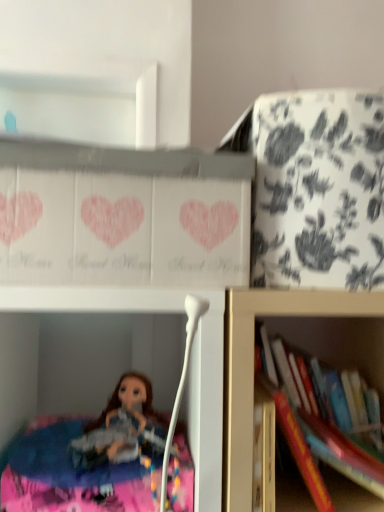
Question: Can you confirm if hardcover book at right, placed as the first book when sorted from back to front, is smaller than hardcover book at lower right, acting as the 1th book starting from the front?

Choices:
 (A) no
 (B) yes

Answer: (A)

Question: From the image's perspective, is hardcover book at right, placed as the first book when sorted from back to front, on top of hardcover book at lower right, positioned as the 2th book in back-to-front order?

Choices:
 (A) yes
 (B) no

Answer: (A)

Question: From the image's perspective, is hardcover book at right, placed as the first book when sorted from back to front, located beneath hardcover book at lower right, positioned as the 2th book in back-to-front order?

Choices:
 (A) yes
 (B) no

Answer: (B)

Question: From a real-world perspective, is hardcover book at right, arranged as the second book when viewed from the front, positioned under hardcover book at lower right, acting as the 1th book starting from the front, based on gravity?

Choices:
 (A) yes
 (B) no

Answer: (B)

Question: Considering the relative positions of hardcover book at right, placed as the first book when sorted from back to front, and hardcover book at lower right, acting as the 1th book starting from the front, in the image provided, is hardcover book at right, placed as the first book when sorted from back to front, to the left of hardcover book at lower right, acting as the 1th book starting from the front, from the viewer's perspective?

Choices:
 (A) yes
 (B) no

Answer: (A)

Question: Would you say hardcover book at right, arranged as the second book when viewed from the front, contains hardcover book at lower right, positioned as the 2th book in back-to-front order?

Choices:
 (A) yes
 (B) no

Answer: (B)

Question: From a real-world perspective, is hardcover book at lower right, positioned as the 2th book in back-to-front order, located beneath hardcover book at right, placed as the first book when sorted from back to front?

Choices:
 (A) no
 (B) yes

Answer: (B)

Question: Can you confirm if hardcover book at lower right, positioned as the 2th book in back-to-front order, is taller than hardcover book at right, placed as the first book when sorted from back to front?

Choices:
 (A) yes
 (B) no

Answer: (B)

Question: Is hardcover book at lower right, acting as the 1th book starting from the front, oriented away from hardcover book at right, placed as the first book when sorted from back to front?

Choices:
 (A) no
 (B) yes

Answer: (B)

Question: From a real-world perspective, does hardcover book at lower right, positioned as the 2th book in back-to-front order, stand above hardcover book at right, placed as the first book when sorted from back to front?

Choices:
 (A) yes
 (B) no

Answer: (B)

Question: Does hardcover book at lower right, acting as the 1th book starting from the front, touch hardcover book at right, arranged as the second book when viewed from the front?

Choices:
 (A) yes
 (B) no

Answer: (A)

Question: Can you confirm if hardcover book at lower right, positioned as the 2th book in back-to-front order, is smaller than hardcover book at right, arranged as the second book when viewed from the front?

Choices:
 (A) yes
 (B) no

Answer: (A)

Question: Is white floral-patterned cabinet at upper right, positioned as the first cabinet in right-to-left order, oriented away from hardcover book at right, placed as the first book when sorted from back to front?

Choices:
 (A) no
 (B) yes

Answer: (A)